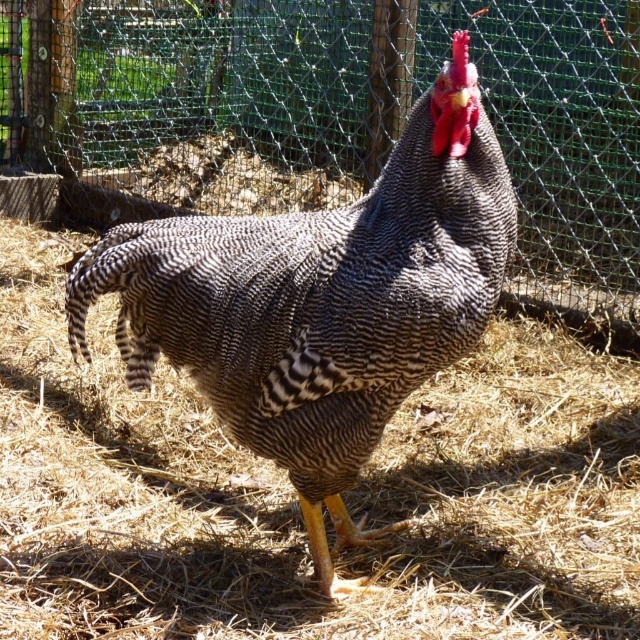
Question: Does green mesh fence at center have a larger size compared to speckled feathered rooster at center?

Choices:
 (A) no
 (B) yes

Answer: (B)

Question: Among these objects, which one is farthest from the camera?

Choices:
 (A) speckled feathered rooster at center
 (B) green mesh fence at center

Answer: (B)

Question: Is green mesh fence at center bigger than speckled feathered rooster at center?

Choices:
 (A) no
 (B) yes

Answer: (B)

Question: Does green mesh fence at center have a lesser width compared to speckled feathered rooster at center?

Choices:
 (A) yes
 (B) no

Answer: (B)

Question: Which object is farther from the camera taking this photo?

Choices:
 (A) speckled feathered rooster at center
 (B) green mesh fence at center

Answer: (B)